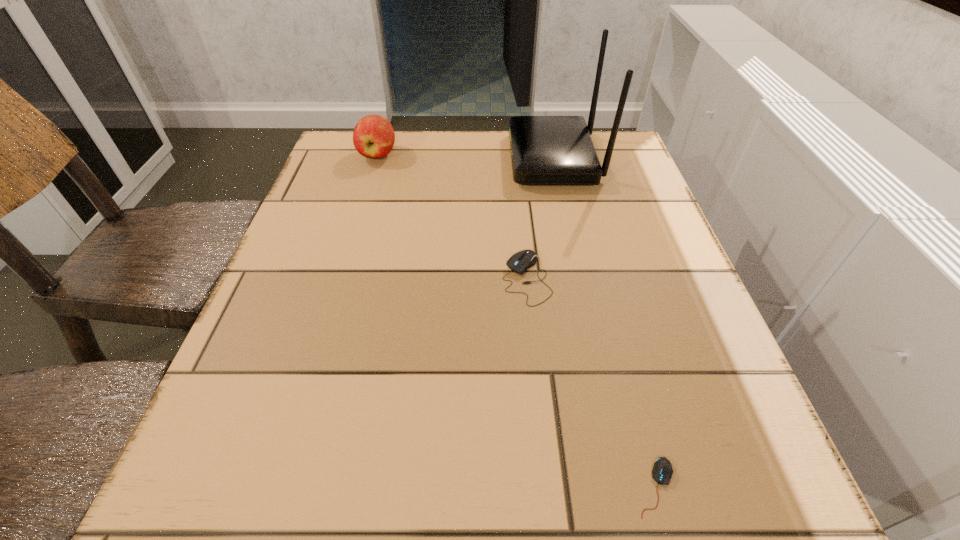
You are a GUI agent. You are given a task and a screenshot of the screen. Output one action in this format:
    pyautogui.click(x=<x>, y=<y>)
    Task: Click on the router
    
    Given the screenshot: What is the action you would take?
    pyautogui.click(x=545, y=150)

Where is `the leftmost object`? This screenshot has height=540, width=960. the leftmost object is located at coordinates (373, 137).

In order to click on apple in this screenshot , I will do coord(373,137).

Find the location of `the third farthest object`. the third farthest object is located at coordinates (521, 261).

You are a GUI agent. You are given a task and a screenshot of the screen. Output one action in this format:
    pyautogui.click(x=<x>, y=<y>)
    Task: Click on the farther mouse
    The height and width of the screenshot is (540, 960).
    Given the screenshot: What is the action you would take?
    pyautogui.click(x=521, y=261)

Where is `the right mouse`? the right mouse is located at coordinates (662, 471).

Where is `the nearest object`? the nearest object is located at coordinates (662, 471).

Image resolution: width=960 pixels, height=540 pixels. In order to click on vacant region located 0.370m on the front-facing side of the tallest object in this screenshot , I will do (x=362, y=159).

At what (x,y) coordinates should I click in order to perform the action: click on free region located 0.310m on the front-facing side of the tallest object. Please return your answer as a coordinate pair (x, y). The image size is (960, 540). Looking at the image, I should click on (386, 159).

Image resolution: width=960 pixels, height=540 pixels. Find the location of `vacant space located on the front-facing side of the tallest object`. vacant space located on the front-facing side of the tallest object is located at coordinates (362, 159).